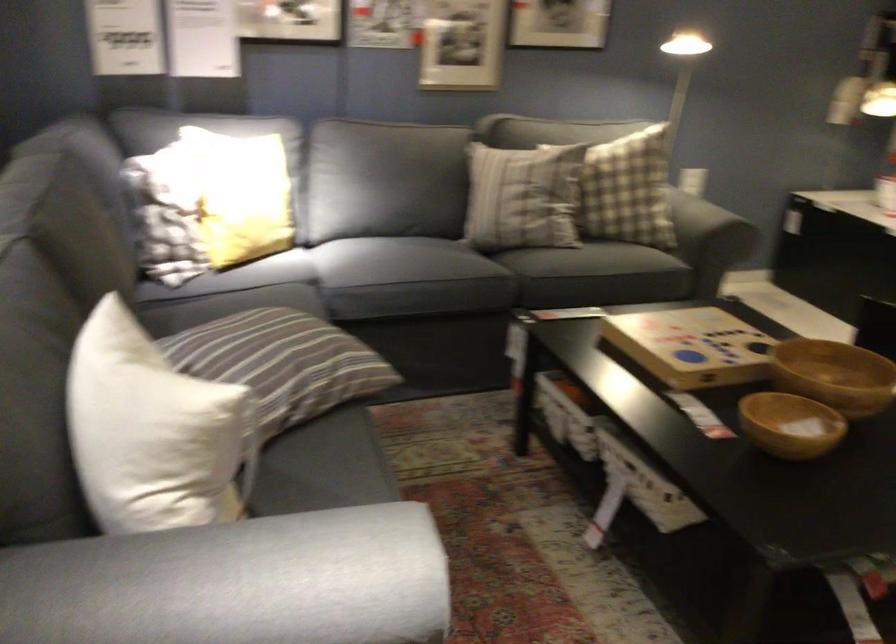
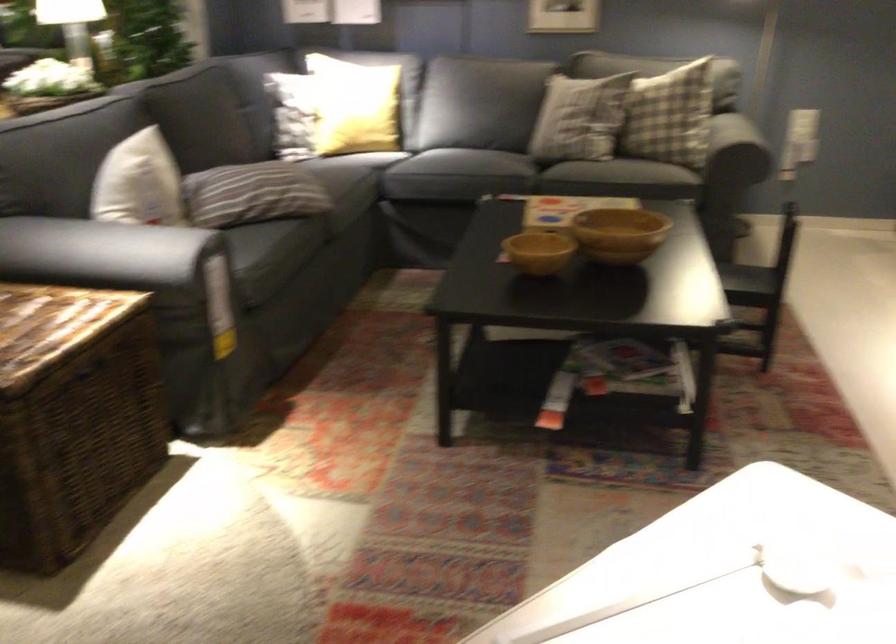
Find the pixel in the second image that matches (x=688, y=204) in the first image.

(668, 115)